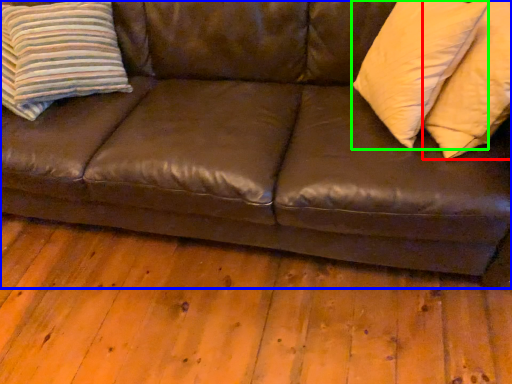
Question: Based on their relative distances, which object is farther from pillow (highlighted by a red box)? Choose from studio couch (highlighted by a blue box) and pillow (highlighted by a green box).

Choices:
 (A) studio couch
 (B) pillow

Answer: (A)